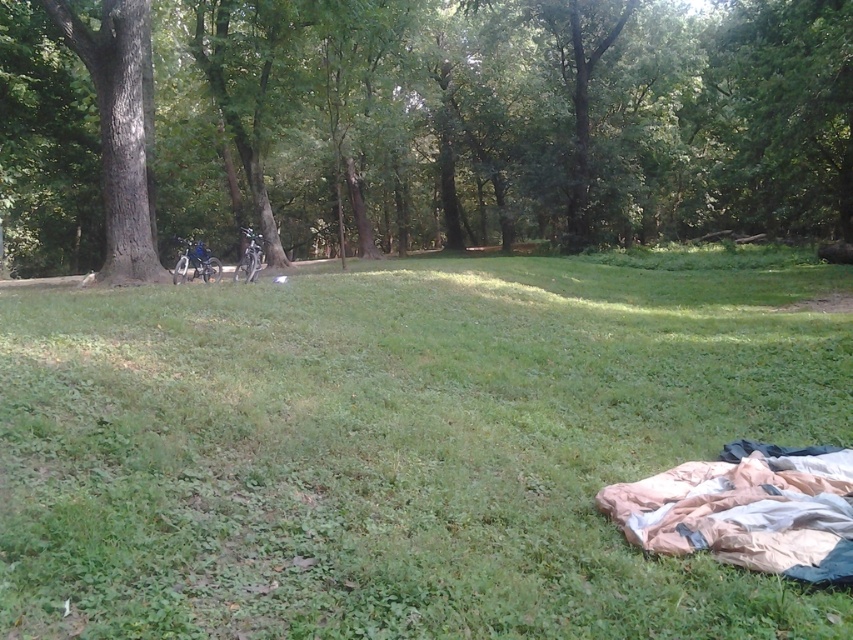
Question: Which object is the farthest from the green rough bark tree at left?

Choices:
 (A) green leafy tree at center
 (B) green grassy at lower right

Answer: (A)

Question: Which point is farther from the camera taking this photo?

Choices:
 (A) (84, 32)
 (B) (381, 278)

Answer: (B)

Question: Does green grassy at lower right appear over green leafy tree at center?

Choices:
 (A) yes
 (B) no

Answer: (B)

Question: From the image, what is the correct spatial relationship of green leafy tree at center in relation to beige nylon sleeping bag at lower right?

Choices:
 (A) right
 (B) left

Answer: (B)

Question: Which of the following is the closest to the observer?

Choices:
 (A) beige nylon sleeping bag at lower right
 (B) green grassy at lower right
 (C) green leafy tree at center

Answer: (A)

Question: From the image, what is the correct spatial relationship of green leafy tree at center in relation to green rough bark tree at left?

Choices:
 (A) left
 (B) right

Answer: (B)